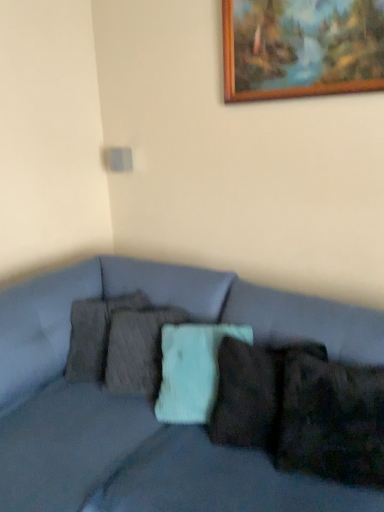
What is the approximate width of textured gray pillow at center, the 2th pillow positioned from the front?

The width of textured gray pillow at center, the 2th pillow positioned from the front, is 11.89 inches.

What is the approximate height of matte gray couch at center?

It is 34.07 inches.

Where is `matte gray couch at center`? matte gray couch at center is located at coordinates (147, 403).

At what (x,y) coordinates should I click in order to perform the action: click on textured gray pillow at center, the second pillow viewed from the right. Please return your answer as a coordinate pair (x, y). Looking at the image, I should click on (95, 334).

I want to click on picture frame that appears above the matte gray couch at center (from a real-world perspective), so click(x=301, y=52).

Which of these two, wooden picture frame at upper center or matte gray couch at center, is thinner?

Thinner between the two is wooden picture frame at upper center.

Does point (370, 75) appear closer or farther from the camera than point (11, 442)?

Point (370, 75).

Which is more to the right, wooden picture frame at upper center or matte gray couch at center?

wooden picture frame at upper center is more to the right.

Based on the photo, who is shorter, textured gray pillow at center, the 1th pillow in the left-to-right sequence, or wooden picture frame at upper center?

wooden picture frame at upper center.

Based on the photo, which object is closer to the camera taking this photo, textured gray pillow at center, positioned as the first pillow in back-to-front order, or wooden picture frame at upper center?

wooden picture frame at upper center.

Between textured gray pillow at center, the 2th pillow positioned from the front, and wooden picture frame at upper center, which one has larger width?

textured gray pillow at center, the 2th pillow positioned from the front.

From the image's perspective, which one is positioned lower, textured gray pillow at center, the second pillow viewed from the right, or wooden picture frame at upper center?

From the image's view, textured gray pillow at center, the second pillow viewed from the right, is below.

From a real-world perspective, which object stands above the other?

velvety brown pillow at lower right, the 2th pillow in the back-to-front sequence.

Between point (346, 369) and point (327, 326), which one is positioned behind?

The point (327, 326) is more distant.

Which object is further away from the camera taking this photo, velvety brown pillow at lower right, the 2th pillow in the back-to-front sequence, or matte gray couch at center?

velvety brown pillow at lower right, the 2th pillow in the back-to-front sequence, is behind.

Considering the relative positions of velvety brown pillow at lower right, positioned as the 1th pillow in right-to-left order, and matte gray couch at center in the image provided, is velvety brown pillow at lower right, positioned as the 1th pillow in right-to-left order, to the right of matte gray couch at center from the viewer's perspective?

Correct, you'll find velvety brown pillow at lower right, positioned as the 1th pillow in right-to-left order, to the right of matte gray couch at center.

Can you tell me how much wooden picture frame at upper center and textured gray pillow at center, the 2th pillow positioned from the front, differ in facing direction?

wooden picture frame at upper center and textured gray pillow at center, the 2th pillow positioned from the front, are facing 38.5 degrees away from each other.

Is point (355, 4) positioned behind point (143, 305)?

No, it is not.

Which of these two, wooden picture frame at upper center or textured gray pillow at center, the 2th pillow positioned from the front, stands shorter?

wooden picture frame at upper center.

Which object is closer to the camera, wooden picture frame at upper center or textured gray pillow at center, positioned as the first pillow in back-to-front order?

wooden picture frame at upper center.

Is matte gray couch at center oriented away from wooden picture frame at upper center?

No, wooden picture frame at upper center is not at the back of matte gray couch at center.

Which object is closer to the camera, matte gray couch at center or wooden picture frame at upper center?

matte gray couch at center is closer to the camera.

How many degrees apart are the facing directions of matte gray couch at center and wooden picture frame at upper center?

They differ by 2.26 degrees in their facing directions.

Is textured gray pillow at center, the second pillow viewed from the right, oriented towards velvety brown pillow at lower right, the 2th pillow in the back-to-front sequence?

No, textured gray pillow at center, the second pillow viewed from the right, does not turn towards velvety brown pillow at lower right, the 2th pillow in the back-to-front sequence.

How different are the orientations of textured gray pillow at center, the 2th pillow positioned from the front, and velvety brown pillow at lower right, positioned as the 1th pillow in right-to-left order, in degrees?

There is a 21.7-degree angle between the facing directions of textured gray pillow at center, the 2th pillow positioned from the front, and velvety brown pillow at lower right, positioned as the 1th pillow in right-to-left order.

Can you confirm if textured gray pillow at center, the second pillow viewed from the right, is smaller than velvety brown pillow at lower right, the 2th pillow in the left-to-right sequence?

Incorrect, textured gray pillow at center, the second pillow viewed from the right, is not smaller in size than velvety brown pillow at lower right, the 2th pillow in the left-to-right sequence.

Which is closer, (74, 364) or (325, 362)?

The point (325, 362) is in front.

Which of these two, matte gray couch at center or velvety brown pillow at lower right, the 2th pillow in the left-to-right sequence, is thinner?

Thinner between the two is velvety brown pillow at lower right, the 2th pillow in the left-to-right sequence.

The height and width of the screenshot is (512, 384). I want to click on studio couch located below the velvety brown pillow at lower right, marked as the 1th pillow in a front-to-back arrangement (from the image's perspective), so click(147, 403).

Is velvety brown pillow at lower right, the 2th pillow in the left-to-right sequence, at the back of matte gray couch at center?

No, matte gray couch at center is not facing the opposite direction of velvety brown pillow at lower right, the 2th pillow in the left-to-right sequence.

From the image's perspective, which one is positioned higher, matte gray couch at center or velvety brown pillow at lower right, the 2th pillow in the left-to-right sequence?

From the image's view, velvety brown pillow at lower right, the 2th pillow in the left-to-right sequence, is above.

Locate an element on the screen. The height and width of the screenshot is (512, 384). picture frame on the right of matte gray couch at center is located at coordinates (301, 52).

What are the coordinates of `picture frame located above the textured gray pillow at center, the second pillow viewed from the right (from a real-world perspective)` in the screenshot? It's located at (301, 52).

Which object lies further to the anchor point velvety brown pillow at lower right, the 2th pillow in the back-to-front sequence, wooden picture frame at upper center or textured gray pillow at center, the 1th pillow in the left-to-right sequence?

wooden picture frame at upper center lies further to velvety brown pillow at lower right, the 2th pillow in the back-to-front sequence, than the other object.

Estimate the real-world distances between objects in this image. Which object is closer to velvety brown pillow at lower right, the 2th pillow in the back-to-front sequence, matte gray couch at center or textured gray pillow at center, the 1th pillow in the left-to-right sequence?

The object closer to velvety brown pillow at lower right, the 2th pillow in the back-to-front sequence, is matte gray couch at center.

Which object lies further to the anchor point matte gray couch at center, velvety brown pillow at lower right, positioned as the 1th pillow in right-to-left order, or textured gray pillow at center, positioned as the first pillow in back-to-front order?

velvety brown pillow at lower right, positioned as the 1th pillow in right-to-left order.

When comparing their distances from wooden picture frame at upper center, does textured gray pillow at center, the second pillow viewed from the right, or matte gray couch at center seem closer?

Among the two, matte gray couch at center is located nearer to wooden picture frame at upper center.

Based on the photo, looking at the image, which one is located further to matte gray couch at center, wooden picture frame at upper center or velvety brown pillow at lower right, the 2th pillow in the left-to-right sequence?

wooden picture frame at upper center.

Looking at the image, which one is located closer to textured gray pillow at center, the 1th pillow in the left-to-right sequence, wooden picture frame at upper center or velvety brown pillow at lower right, positioned as the 1th pillow in right-to-left order?

Among the two, velvety brown pillow at lower right, positioned as the 1th pillow in right-to-left order, is located nearer to textured gray pillow at center, the 1th pillow in the left-to-right sequence.

Based on their spatial positions, is velvety brown pillow at lower right, marked as the 1th pillow in a front-to-back arrangement, or wooden picture frame at upper center closer to matte gray couch at center?

The object closer to matte gray couch at center is velvety brown pillow at lower right, marked as the 1th pillow in a front-to-back arrangement.

From the image, which object appears to be nearer to velvety brown pillow at lower right, the 2th pillow in the left-to-right sequence, matte gray couch at center or wooden picture frame at upper center?

matte gray couch at center.

The image size is (384, 512). What are the coordinates of `pillow between matte gray couch at center and textured gray pillow at center, positioned as the first pillow in back-to-front order, along the z-axis` in the screenshot? It's located at (330, 418).

Image resolution: width=384 pixels, height=512 pixels. What are the coordinates of `pillow that lies between wooden picture frame at upper center and velvety brown pillow at lower right, positioned as the 1th pillow in right-to-left order, from top to bottom` in the screenshot? It's located at (95, 334).